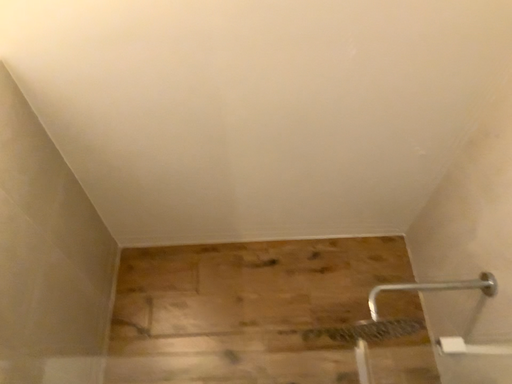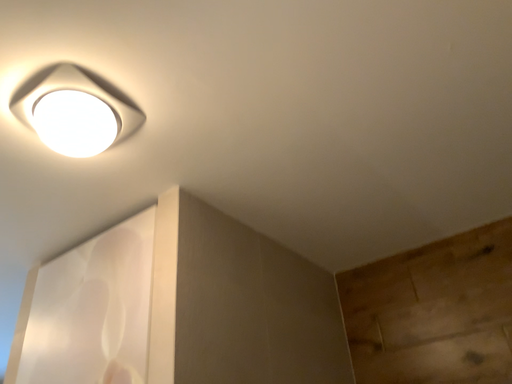
Question: Which way did the camera rotate in the video?

Choices:
 (A) rotated upward
 (B) rotated downward

Answer: (B)